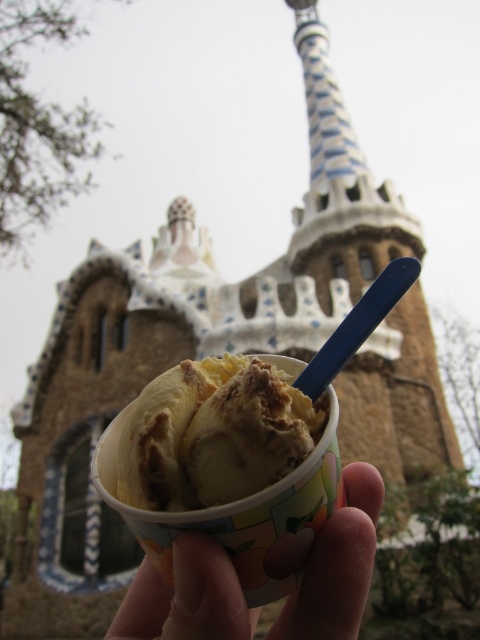
Question: Is vanilla ice cream at center to the right of smooth skin hand at center from the viewer's perspective?

Choices:
 (A) no
 (B) yes

Answer: (B)

Question: From the image, what is the correct spatial relationship of vanilla ice cream at center in relation to smooth skin hand at center?

Choices:
 (A) right
 (B) left

Answer: (A)

Question: Observing the image, what is the correct spatial positioning of vanilla ice cream at center in reference to smooth skin hand at center?

Choices:
 (A) right
 (B) left

Answer: (A)

Question: Which point is closer to the camera taking this photo?

Choices:
 (A) (175, 392)
 (B) (307, 605)

Answer: (B)

Question: Which of the following is the farthest from the observer?

Choices:
 (A) vanilla ice cream at center
 (B) smooth skin hand at center

Answer: (A)

Question: Which of the following is the farthest from the observer?

Choices:
 (A) vanilla ice cream at center
 (B) smooth skin hand at center

Answer: (A)